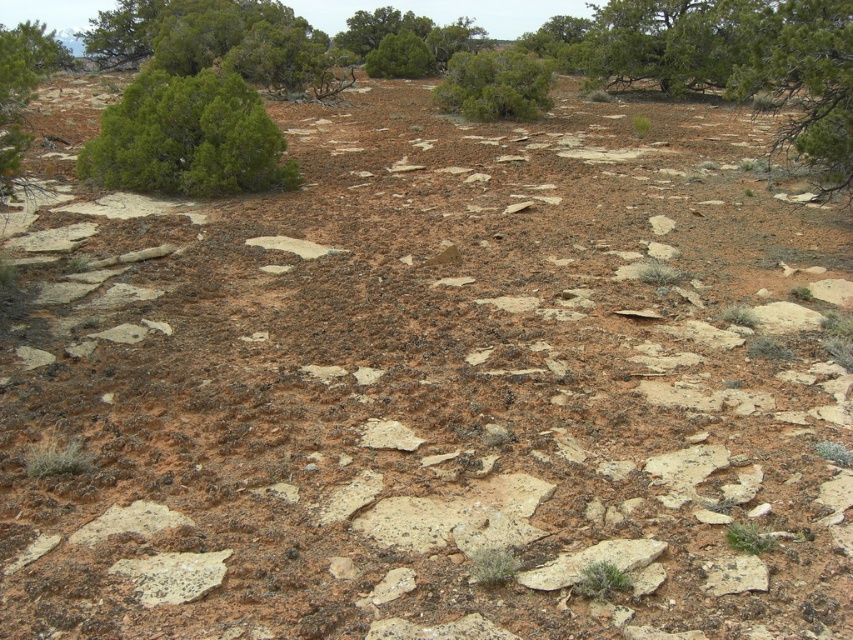
Question: Which of the following is the closest to the observer?

Choices:
 (A) (833, 160)
 (B) (375, 72)

Answer: (A)

Question: Based on their relative distances, which object is nearer to the green leafy tree at upper right?

Choices:
 (A) green leafy bush at upper left
 (B) green shrub at center

Answer: (B)

Question: Which of the following is the closest to the observer?

Choices:
 (A) (x=447, y=64)
 (B) (x=756, y=22)
 (C) (x=407, y=65)

Answer: (B)

Question: Is green leafy tree at upper right positioned in front of green matte bush at upper center?

Choices:
 (A) no
 (B) yes

Answer: (B)

Question: Does green shrub at center have a greater width compared to green matte bush at upper center?

Choices:
 (A) yes
 (B) no

Answer: (A)

Question: Does green leafy bush at upper left lie behind green leafy tree at upper right?

Choices:
 (A) no
 (B) yes

Answer: (B)